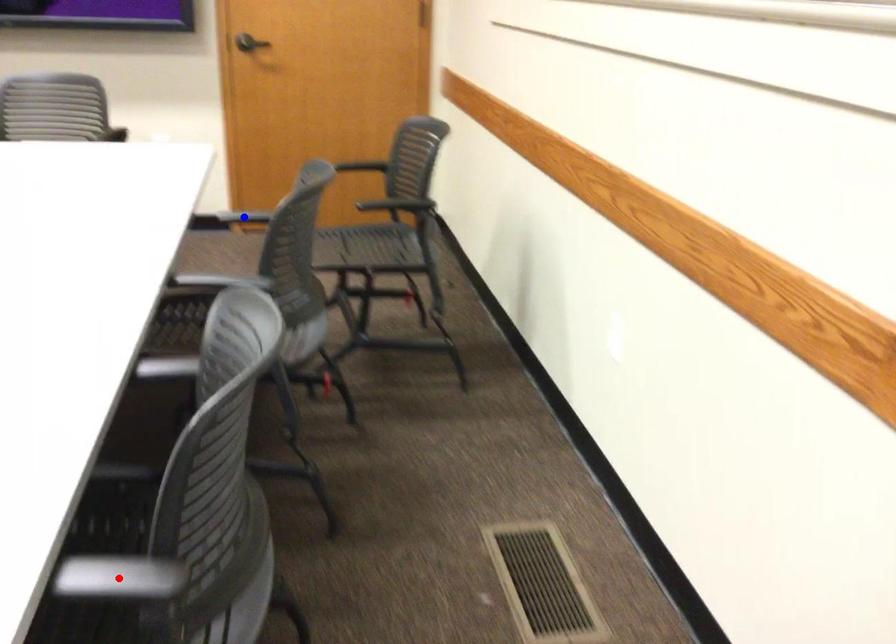
Question: In the image, two points are highlighted. Which point is nearer to the camera? Reply with the corresponding letter.

Choices:
 (A) blue point
 (B) red point

Answer: (B)